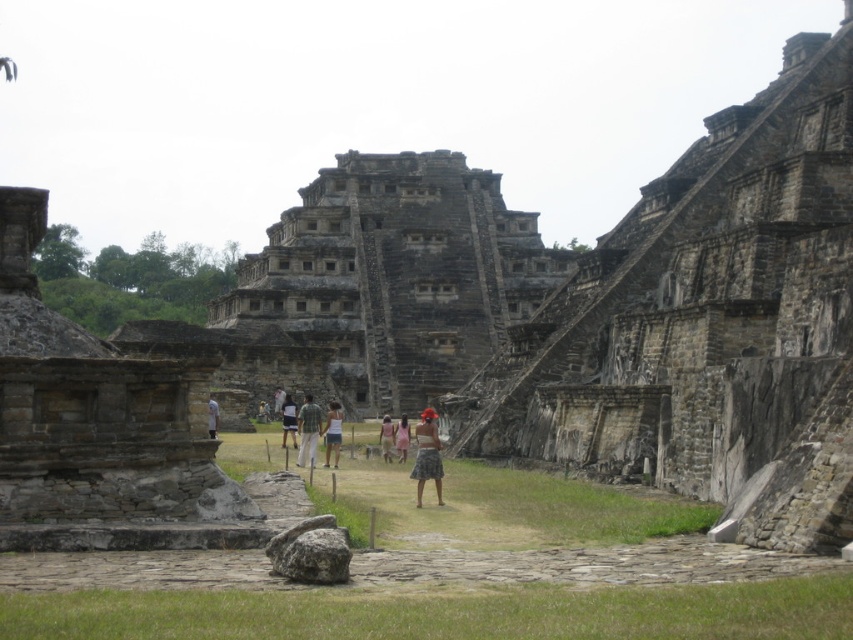
Question: Which object is farther from the camera taking this photo?

Choices:
 (A) gray stone ruins at center
 (B) green plaid shirt at center
 (C) dark gray stone ruins at center
 (D) light pink fabric skirt at center

Answer: (C)

Question: Does dark gray stone ruins at center have a smaller size compared to plaid skirt at center?

Choices:
 (A) no
 (B) yes

Answer: (A)

Question: Can you confirm if light pink fabric skirt at center is positioned to the left of light brown stone person at center?

Choices:
 (A) yes
 (B) no

Answer: (B)

Question: Where is plaid skirt at center located in relation to white cotton tank top at center in the image?

Choices:
 (A) below
 (B) above

Answer: (A)

Question: Which point is farther to the camera?

Choices:
 (A) dark gray stone ruins at center
 (B) light pink fabric skirt at center

Answer: (A)

Question: Among these objects, which one is farthest from the camera?

Choices:
 (A) white cotton tank top at center
 (B) light blue denim shorts at center
 (C) dark gray stone ruins at center

Answer: (C)